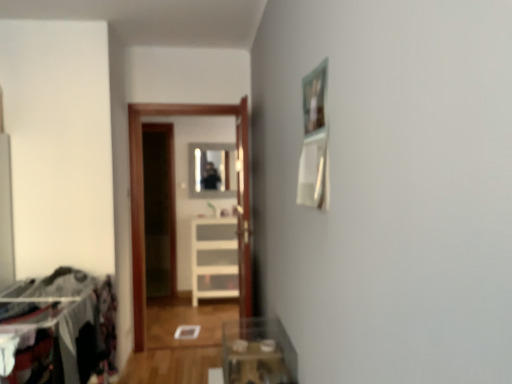
Question: Considering the positions of point (267, 349) and point (52, 327), is point (267, 349) closer or farther from the camera than point (52, 327)?

Choices:
 (A) farther
 (B) closer

Answer: (A)

Question: Is clear glass table at lower center to the left or to the right of dark fabric laundry at left in the image?

Choices:
 (A) right
 (B) left

Answer: (A)

Question: Which is nearer to the white plastic drawer at center?

Choices:
 (A) transparent glass door at center
 (B) dark fabric laundry at left
 (C) clear glass mirror at center
 (D) clear glass table at lower center

Answer: (C)

Question: Estimate the real-world distances between objects in this image. Which object is farther from the clear glass table at lower center?

Choices:
 (A) clear glass mirror at center
 (B) dark fabric laundry at left
 (C) transparent glass door at center
 (D) white plastic drawer at center

Answer: (A)